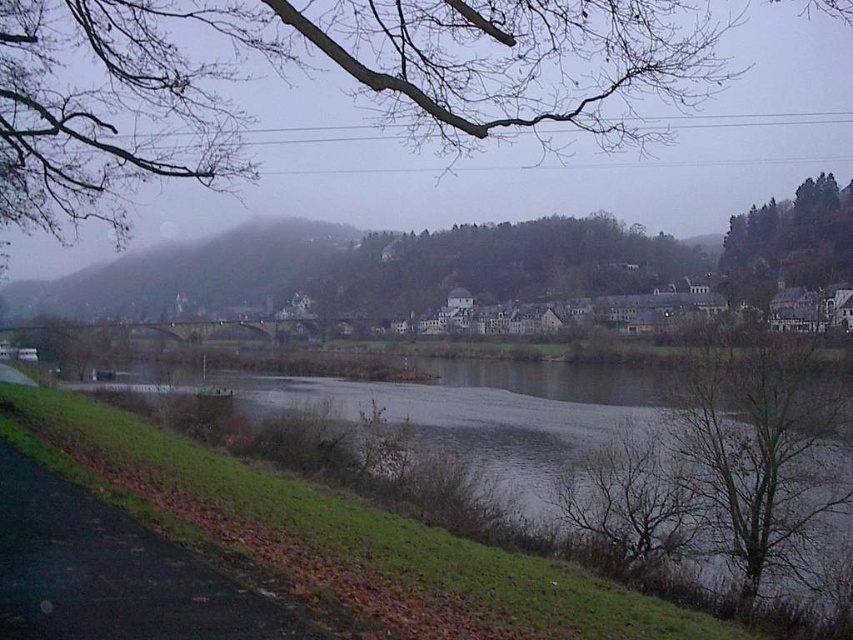
Is the position of gray smooth water at lower left less distant than that of green leafy tree at upper right?

Yes, gray smooth water at lower left is closer to the viewer.

Who is taller, gray smooth water at lower left or green leafy tree at upper right?

green leafy tree at upper right is taller.

Which is in front, point (619, 417) or point (782, 248)?

Point (619, 417)

In order to click on gray smooth water at lower left in this screenshot , I will do `click(479, 406)`.

Based on the photo, does bare branches at upper center have a greater height compared to bare branches at lower right?

Indeed, bare branches at upper center has a greater height compared to bare branches at lower right.

Identify the location of bare branches at upper center. This screenshot has width=853, height=640. coord(310,67).

The width and height of the screenshot is (853, 640). Describe the element at coordinates (310, 67) in the screenshot. I see `bare branches at upper center` at that location.

Does bare branches at upper center appear under gray smooth water at lower left?

No.

Where is `bare branches at upper center`? The image size is (853, 640). bare branches at upper center is located at coordinates (310, 67).